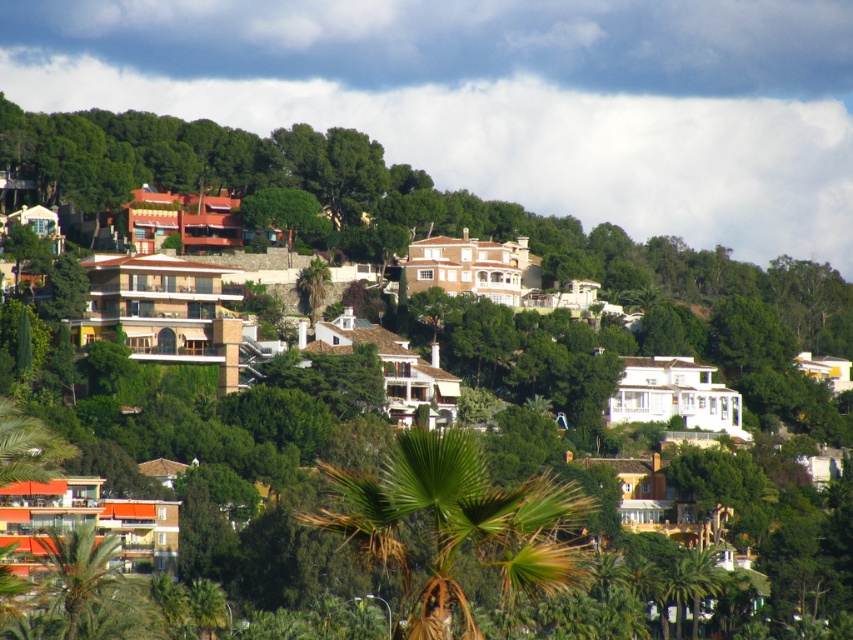
Can you confirm if white fluffy cloud at upper center is positioned to the left of green leafy palm tree at lower left?

In fact, white fluffy cloud at upper center is to the right of green leafy palm tree at lower left.

Which of these two, white fluffy cloud at upper center or green leafy palm tree at lower left, stands taller?

white fluffy cloud at upper center

Which is in front, point (36, 32) or point (86, 593)?

Point (86, 593)

Where is `white fluffy cloud at upper center`? This screenshot has height=640, width=853. white fluffy cloud at upper center is located at coordinates (503, 97).

Can you confirm if white fluffy cloud at upper center is wider than green leafy palm tree at center?

Yes, white fluffy cloud at upper center is wider than green leafy palm tree at center.

This screenshot has width=853, height=640. I want to click on white fluffy cloud at upper center, so click(x=503, y=97).

The width and height of the screenshot is (853, 640). In order to click on white fluffy cloud at upper center in this screenshot , I will do pos(503,97).

Is green leafy palm tree at center shorter than green leafy palm tree at lower left?

No.

Is green leafy palm tree at center to the left of green leafy palm tree at lower left from the viewer's perspective?

In fact, green leafy palm tree at center is to the right of green leafy palm tree at lower left.

Does point (543, 508) come in front of point (102, 548)?

Yes, point (543, 508) is in front of point (102, 548).

Locate an element on the screen. green leafy palm tree at center is located at coordinates (456, 528).